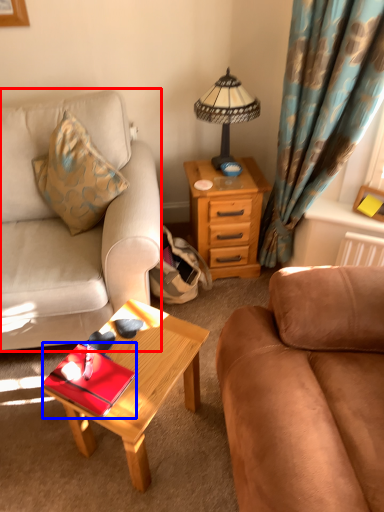
Question: Which of the following is the closest to the observer, studio couch (highlighted by a red box) or tray (highlighted by a blue box)?

Choices:
 (A) studio couch
 (B) tray

Answer: (B)